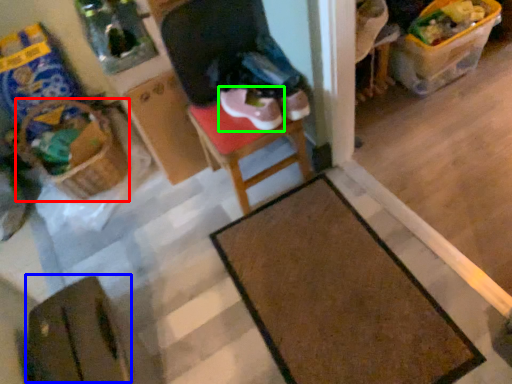
Question: Which object is the farthest from basket (highlighted by a red box)? Choose among these: wide (highlighted by a blue box) or footwear (highlighted by a green box).

Choices:
 (A) wide
 (B) footwear

Answer: (A)